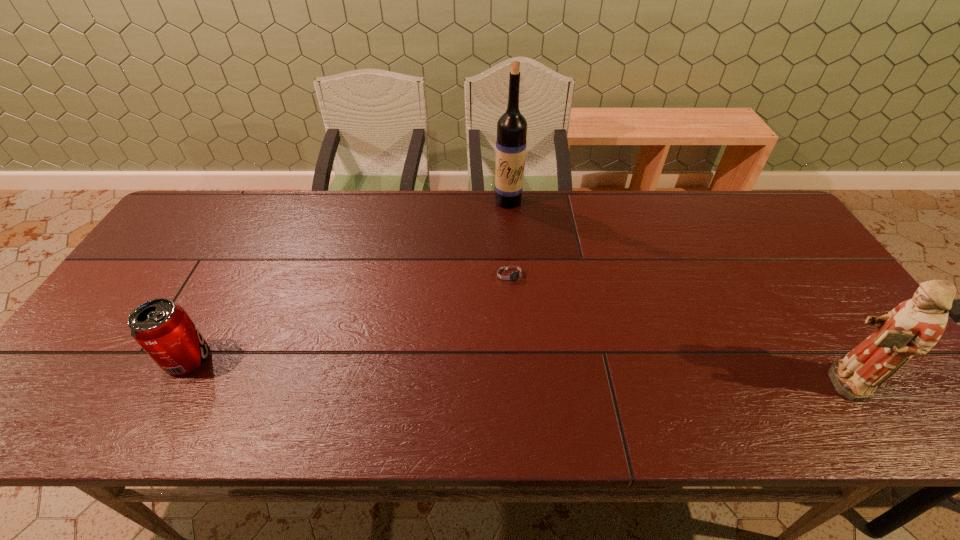
I want to click on empty space between the wine bottle and the third shortest object, so click(x=673, y=292).

Image resolution: width=960 pixels, height=540 pixels. Identify the location of empty space that is in between the shortest object and the rightmost object. (675, 328).

This screenshot has height=540, width=960. In order to click on vacant area that lies between the watch and the figurine in this screenshot , I will do `click(675, 328)`.

The image size is (960, 540). I want to click on empty space that is in between the figurine and the farthest object, so click(673, 292).

The width and height of the screenshot is (960, 540). In order to click on vacant point located between the rightmost object and the leftmost object in this screenshot , I will do `click(513, 370)`.

You are a GUI agent. You are given a task and a screenshot of the screen. Output one action in this format:
    pyautogui.click(x=<x>, y=<y>)
    Task: Click on the free space between the second farthest object and the tallest object
    This screenshot has height=540, width=960.
    Given the screenshot: What is the action you would take?
    pyautogui.click(x=510, y=238)

Identify the location of vacant region between the second shortest object and the wine bottle. (348, 280).

This screenshot has width=960, height=540. I want to click on blank region between the leftmost object and the wine bottle, so click(x=348, y=280).

Where is `empty space between the figurine and the farthest object`? Image resolution: width=960 pixels, height=540 pixels. empty space between the figurine and the farthest object is located at coordinates (673, 292).

You are a GUI agent. You are given a task and a screenshot of the screen. Output one action in this format:
    pyautogui.click(x=<x>, y=<y>)
    Task: Click on the object that is the third nearest to the third nearest object
    The height and width of the screenshot is (540, 960).
    Given the screenshot: What is the action you would take?
    pyautogui.click(x=162, y=328)